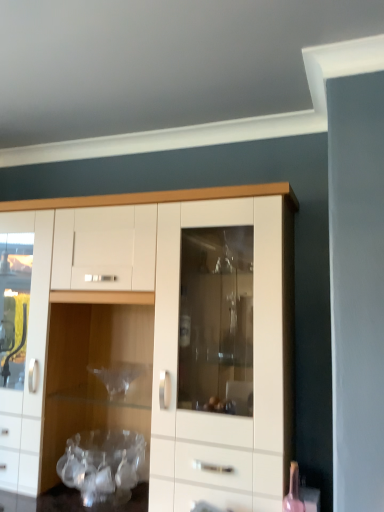
Find the location of a particular element. This screenshot has height=512, width=384. white glossy cupboard at center is located at coordinates (152, 346).

The image size is (384, 512). What do you see at coordinates (152, 346) in the screenshot? I see `white glossy cupboard at center` at bounding box center [152, 346].

Where is `white glossy cupboard at center`? The image size is (384, 512). white glossy cupboard at center is located at coordinates (152, 346).